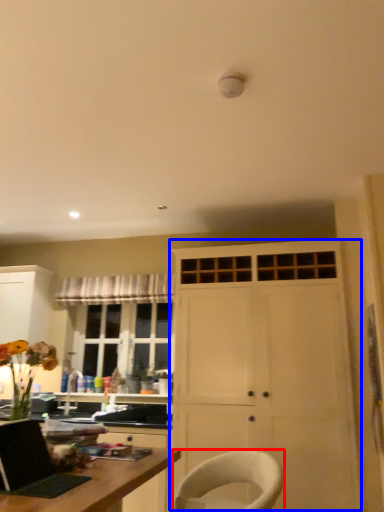
Question: Which point is closer to the camera, chair (highlighted by a red box) or cabinetry (highlighted by a blue box)?

Choices:
 (A) chair
 (B) cabinetry

Answer: (A)